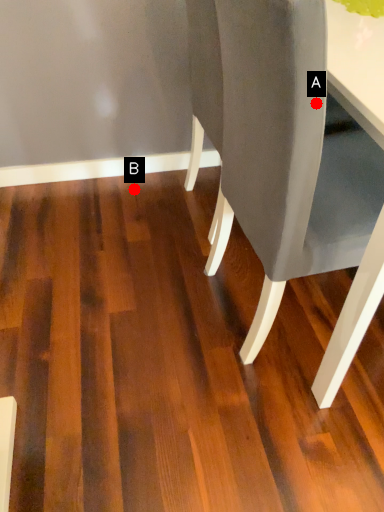
Question: Two points are circled on the image, labeled by A and B beside each circle. Which point is closer to the camera?

Choices:
 (A) A is closer
 (B) B is closer

Answer: (A)